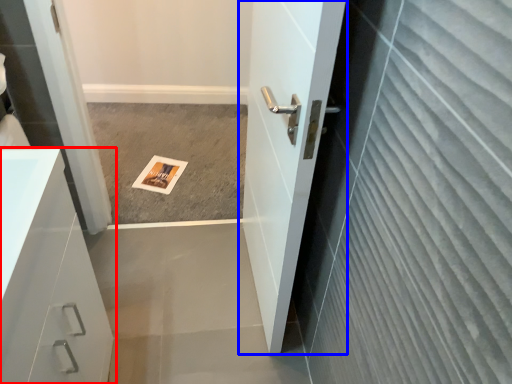
Question: Which object appears farthest to the camera in this image, bathroom cabinet (highlighted by a red box) or door (highlighted by a blue box)?

Choices:
 (A) bathroom cabinet
 (B) door

Answer: (B)